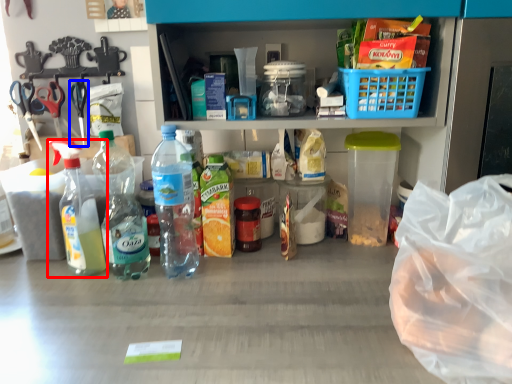
Question: Which object is closer to the camera taking this photo, bottle (highlighted by a red box) or scissors (highlighted by a blue box)?

Choices:
 (A) bottle
 (B) scissors

Answer: (A)